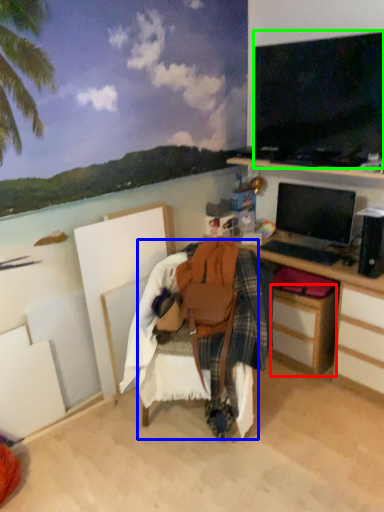
Question: Considering the real-world distances, which object is closest to drawer (highlighted by a red box)? chair (highlighted by a blue box) or television (highlighted by a green box).

Choices:
 (A) chair
 (B) television

Answer: (A)